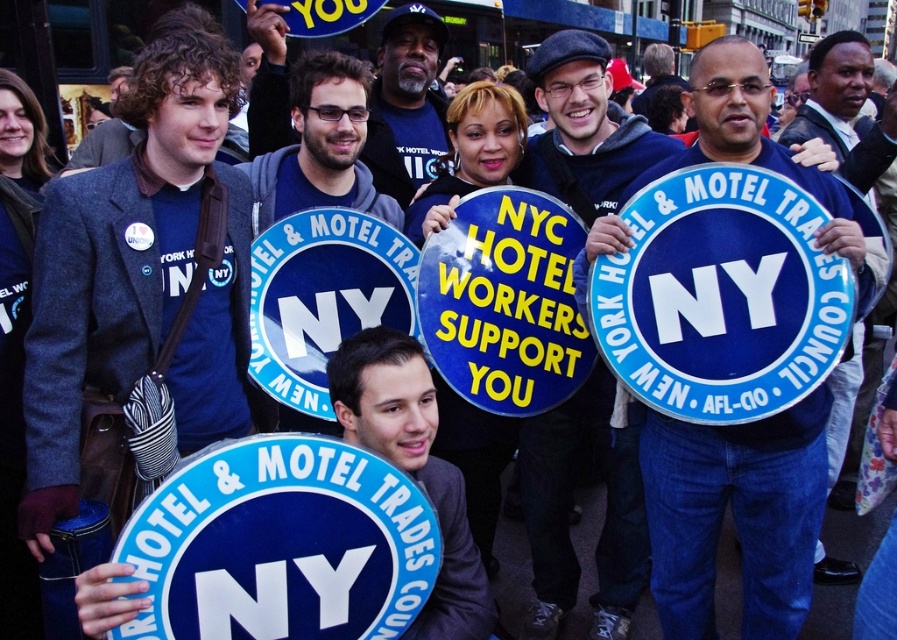
Question: Is matte gray blazer at center smaller than blue fabric shirt at right?

Choices:
 (A) yes
 (B) no

Answer: (A)

Question: Does matte gray blazer at center appear on the left side of matte blue shirt at center?

Choices:
 (A) yes
 (B) no

Answer: (A)

Question: Considering the relative positions of blue matte sign at center and matte blue shirt at center in the image provided, where is blue matte sign at center located with respect to matte blue shirt at center?

Choices:
 (A) below
 (B) above

Answer: (A)

Question: Which point appears farthest from the camera in this image?

Choices:
 (A) (133, 84)
 (B) (354, 150)
 (C) (765, 109)
 (D) (795, 138)

Answer: (D)

Question: Which point is farther from the camera taking this photo?

Choices:
 (A) (314, 77)
 (B) (784, 134)
 (C) (71, 490)
 (D) (433, 17)

Answer: (D)

Question: Which object is farther from the camera taking this photo?

Choices:
 (A) matte blue shirt at center
 (B) blue matte sign at center

Answer: (A)